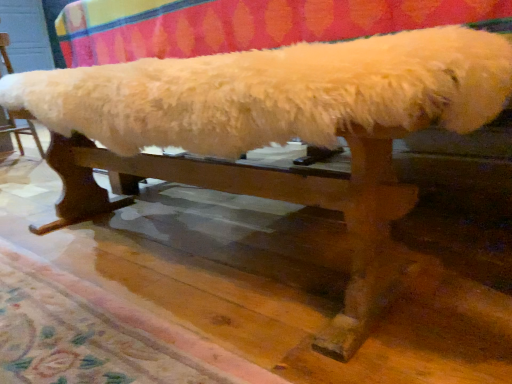
Question: Should I look upward or downward to see white fluffy bench at upper center?

Choices:
 (A) down
 (B) up

Answer: (B)

Question: Is white fluffy bench at upper center positioned with its back to carpeted floor at lower center?

Choices:
 (A) yes
 (B) no

Answer: (B)

Question: Can you see white fluffy bench at upper center touching carpeted floor at lower center?

Choices:
 (A) yes
 (B) no

Answer: (B)

Question: Can you confirm if white fluffy bench at upper center is wider than carpeted floor at lower center?

Choices:
 (A) yes
 (B) no

Answer: (B)

Question: Is white fluffy bench at upper center not inside carpeted floor at lower center?

Choices:
 (A) yes
 (B) no

Answer: (A)

Question: From the image's perspective, is white fluffy bench at upper center above carpeted floor at lower center?

Choices:
 (A) no
 (B) yes

Answer: (B)

Question: Does white fluffy bench at upper center turn towards carpeted floor at lower center?

Choices:
 (A) no
 (B) yes

Answer: (A)

Question: Considering the relative positions of carpeted floor at lower center and white fluffy bench at upper center in the image provided, is carpeted floor at lower center to the left of white fluffy bench at upper center from the viewer's perspective?

Choices:
 (A) no
 (B) yes

Answer: (A)

Question: Is carpeted floor at lower center facing towards white fluffy bench at upper center?

Choices:
 (A) no
 (B) yes

Answer: (A)

Question: Does carpeted floor at lower center lie behind white fluffy bench at upper center?

Choices:
 (A) yes
 (B) no

Answer: (B)

Question: From a real-world perspective, is carpeted floor at lower center positioned under white fluffy bench at upper center based on gravity?

Choices:
 (A) no
 (B) yes

Answer: (B)

Question: Considering the relative sizes of carpeted floor at lower center and white fluffy bench at upper center in the image provided, is carpeted floor at lower center smaller than white fluffy bench at upper center?

Choices:
 (A) yes
 (B) no

Answer: (A)

Question: Can you confirm if carpeted floor at lower center is shorter than white fluffy bench at upper center?

Choices:
 (A) no
 (B) yes

Answer: (B)

Question: In terms of width, does white fluffy bench at upper center look wider or thinner when compared to carpeted floor at lower center?

Choices:
 (A) wide
 (B) thin

Answer: (B)